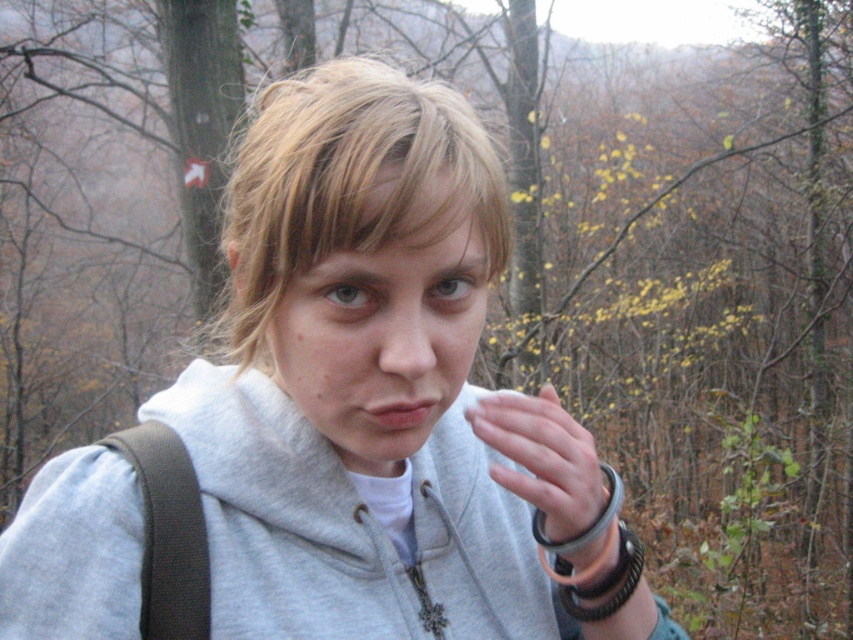
Question: Which point is farther to the camera?

Choices:
 (A) (541, 388)
 (B) (109, 632)
 (C) (418, 202)
 (D) (364, 177)

Answer: (A)

Question: Does blondehair at center have a larger size compared to white matte cloth at center?

Choices:
 (A) no
 (B) yes

Answer: (B)

Question: Is the position of gray hoodie at center less distant than that of blondehair at center?

Choices:
 (A) no
 (B) yes

Answer: (A)

Question: Is blondehair at center below white matte cloth at center?

Choices:
 (A) yes
 (B) no

Answer: (B)

Question: Based on their relative distances, which object is nearer to the gray sweatshirt at center?

Choices:
 (A) blondehair at center
 (B) white matte cloth at center

Answer: (A)

Question: Which point appears farthest from the camera in this image?

Choices:
 (A) (572, 588)
 (B) (248, 262)

Answer: (A)